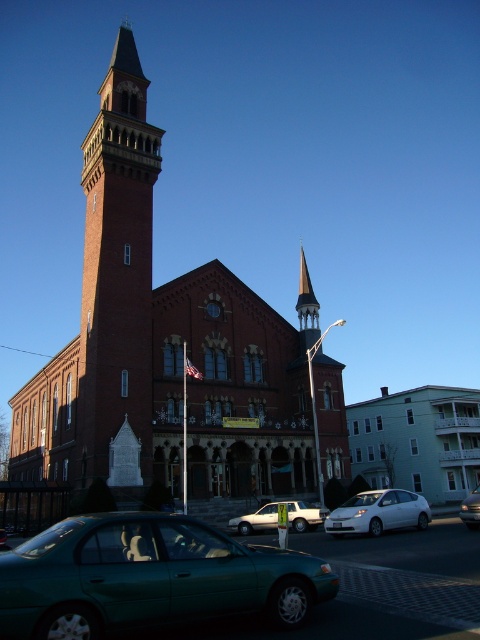
Question: Is brick bell tower at left positioned before white matte car at lower right?

Choices:
 (A) yes
 (B) no

Answer: (B)

Question: Can you confirm if white matte car at lower right is positioned to the right of white matte van at lower center?

Choices:
 (A) yes
 (B) no

Answer: (A)

Question: Does brick church at center have a larger size compared to white matte car at lower right?

Choices:
 (A) no
 (B) yes

Answer: (B)

Question: Which is nearer to the brick bell tower at left?

Choices:
 (A) brick church at center
 (B) white matte car at lower right
 (C) matte white sedan at center

Answer: (A)

Question: Which point is closer to the camera?

Choices:
 (A) (195, 433)
 (B) (395, 518)
 (C) (233, 556)

Answer: (C)

Question: Which point appears closest to the camera in this image?

Choices:
 (A) (297, 500)
 (B) (154, 138)
 (C) (463, 522)

Answer: (C)